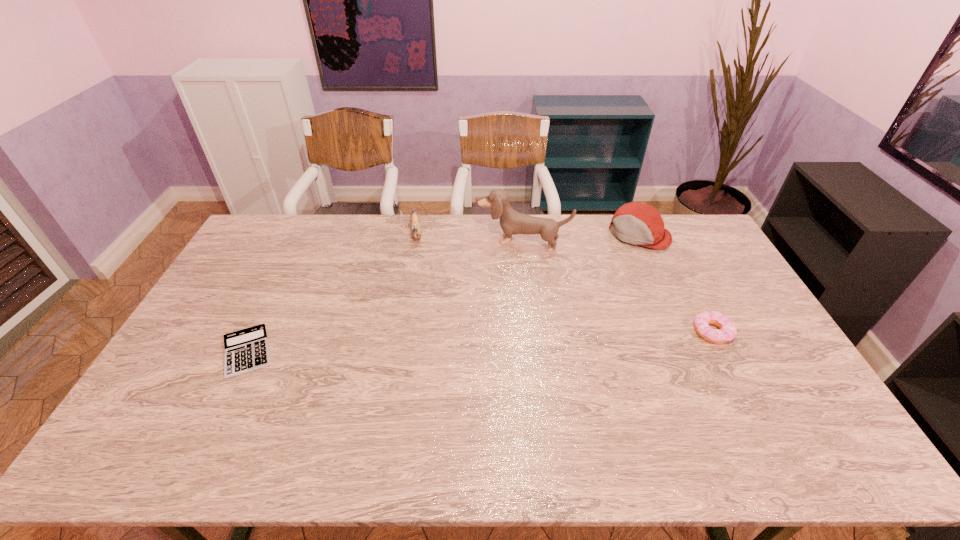
Find the location of a particular element. This screenshot has height=540, width=960. free space between the banana and the fourth tallest object is located at coordinates (564, 282).

You are a GUI agent. You are given a task and a screenshot of the screen. Output one action in this format:
    pyautogui.click(x=<x>, y=<y>)
    Task: Click on the free space between the doughnut and the tallest object
    The image size is (960, 540).
    Given the screenshot: What is the action you would take?
    pyautogui.click(x=616, y=287)

The height and width of the screenshot is (540, 960). Identify the location of vacant space in between the shortest object and the tallest object. (385, 297).

The image size is (960, 540). Find the location of `free space between the cap and the doughnut`. free space between the cap and the doughnut is located at coordinates (676, 283).

Where is `vacant area that lies between the cap and the doughnut`? vacant area that lies between the cap and the doughnut is located at coordinates (676, 283).

I want to click on free spot between the second shortest object and the puppy, so click(x=616, y=287).

The image size is (960, 540). What are the coordinates of `free point between the puppy and the cap` in the screenshot? It's located at (580, 238).

Identify the location of vacant space in between the cap and the leftmost object. The height and width of the screenshot is (540, 960). (444, 293).

I want to click on blank region between the puppy and the leftmost object, so [385, 297].

Identify the location of vacant region between the third object from left to right and the banana. The height and width of the screenshot is (540, 960). (469, 237).